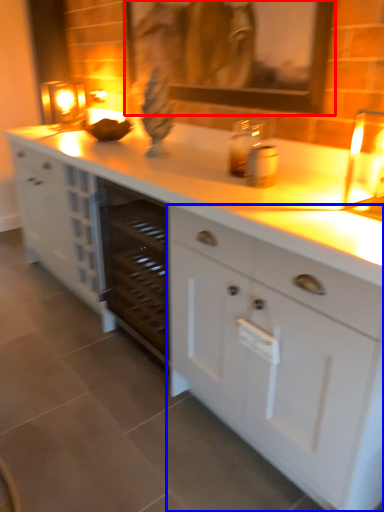
Question: Which point is closer to the camera, picture frame (highlighted by a red box) or cabinetry (highlighted by a blue box)?

Choices:
 (A) picture frame
 (B) cabinetry

Answer: (B)